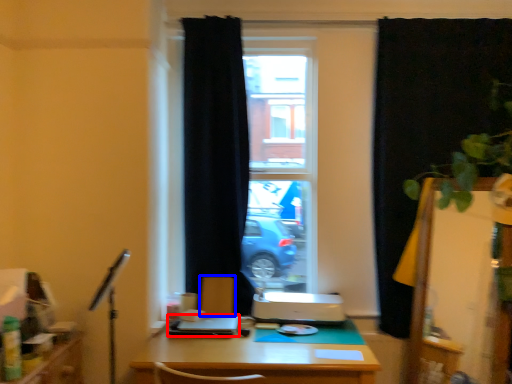
Question: Which point is further to the camera, laptop (highlighted by a red box) or armchair (highlighted by a blue box)?

Choices:
 (A) laptop
 (B) armchair

Answer: (B)